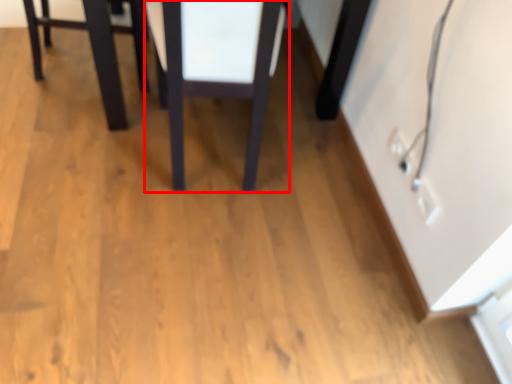
Question: Considering the relative positions of table (annotated by the red box) and furniture in the image provided, where is table (annotated by the red box) located with respect to the staircase?

Choices:
 (A) left
 (B) right

Answer: (B)